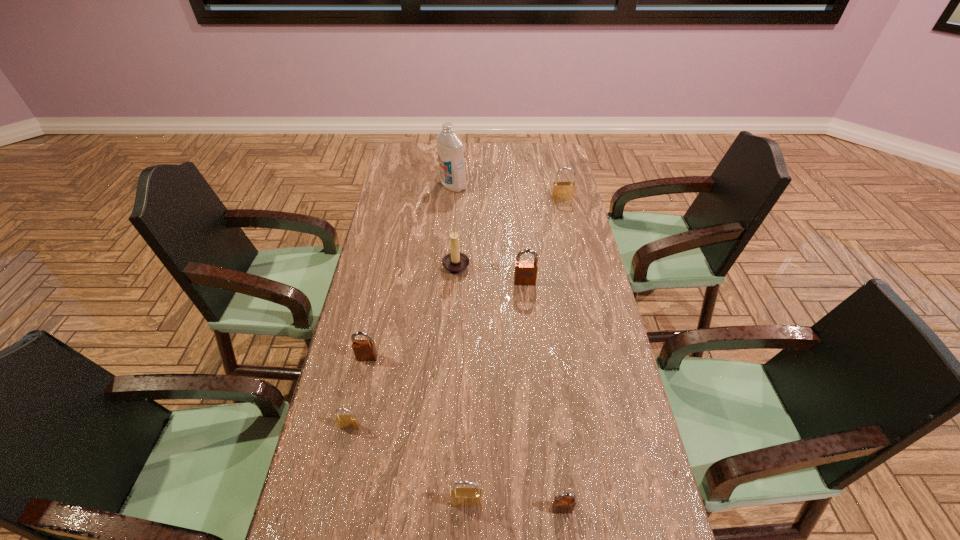
The height and width of the screenshot is (540, 960). I want to click on detergent, so click(x=449, y=146).

Identify the location of the farthest object. The height and width of the screenshot is (540, 960). (449, 146).

Find the location of a particular element. The image size is (960, 540). candle holder is located at coordinates (455, 262).

Image resolution: width=960 pixels, height=540 pixels. I want to click on the third farthest object, so click(x=455, y=262).

Image resolution: width=960 pixels, height=540 pixels. I want to click on the rightmost object, so click(x=561, y=190).

Where is `the farthest padlock`? This screenshot has width=960, height=540. the farthest padlock is located at coordinates (561, 190).

I want to click on the farthest brown padlock, so click(x=525, y=273).

The width and height of the screenshot is (960, 540). What are the coordinates of `the biggest brown padlock` in the screenshot? It's located at (525, 273).

At what (x,y) coordinates should I click in order to perform the action: click on the leftmost brown padlock. Please return your answer as a coordinate pair (x, y). Looking at the image, I should click on (364, 350).

This screenshot has width=960, height=540. I want to click on the second smallest brown padlock, so click(364, 350).